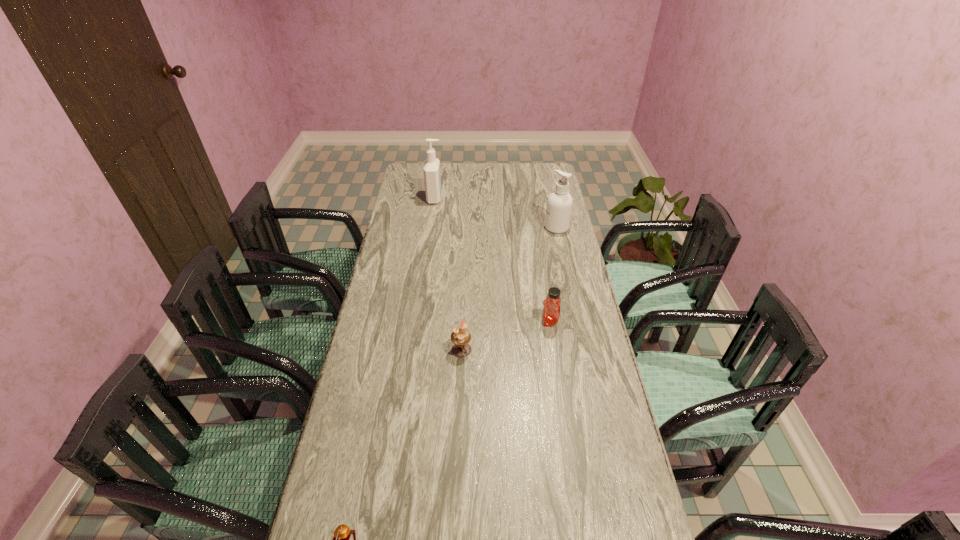
This screenshot has height=540, width=960. I want to click on the left cleansing agent, so click(432, 177).

Find the location of a particular element. The width and height of the screenshot is (960, 540). the farthest object is located at coordinates (432, 177).

The height and width of the screenshot is (540, 960). I want to click on the right cleansing agent, so click(x=559, y=205).

Where is `the rightmost object`? The image size is (960, 540). the rightmost object is located at coordinates (559, 205).

Identify the location of the third farthest object. (551, 311).

Identify the location of the fourth object from left to right. (551, 311).

Where is `the third object from left to right`? This screenshot has width=960, height=540. the third object from left to right is located at coordinates (461, 337).

Find the location of a particular element. the second nearest object is located at coordinates (461, 337).

You are a GUI agent. You are given a task and a screenshot of the screen. Output one action in this format:
    pyautogui.click(x=<x>, y=<y>)
    Task: Click on the vacant space located 0.060m on the front label of the left cleansing agent
    Image resolution: width=960 pixels, height=540 pixels.
    Given the screenshot: What is the action you would take?
    pyautogui.click(x=455, y=198)

The width and height of the screenshot is (960, 540). I want to click on vacant space located on the front label of the right cleansing agent, so click(x=488, y=227).